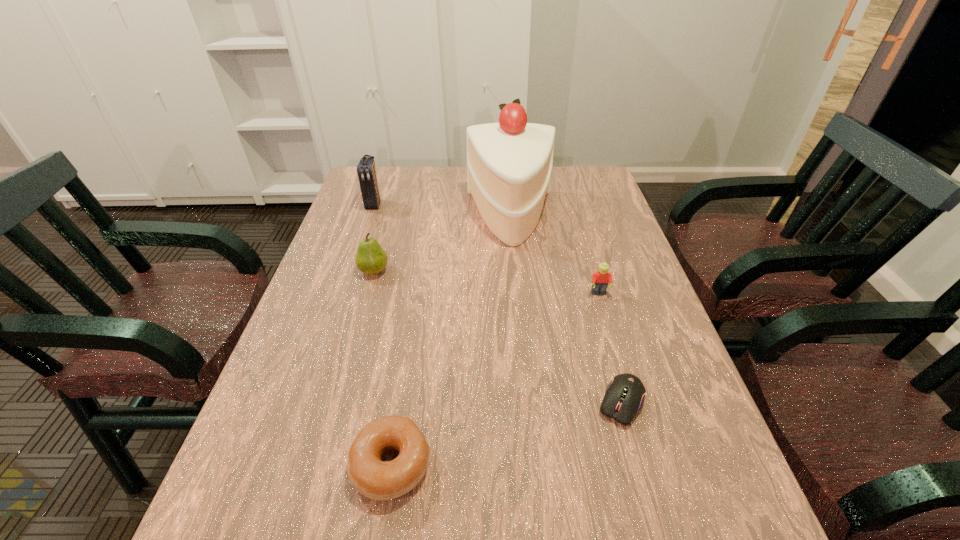
What are the coordinates of `vacant space located 0.200m on the left of the cake` in the screenshot? It's located at (402, 217).

Where is `vacant region located with the zip open on the clutch bag`? The width and height of the screenshot is (960, 540). vacant region located with the zip open on the clutch bag is located at coordinates (368, 224).

You are a GUI agent. You are given a task and a screenshot of the screen. Output one action in this format:
    pyautogui.click(x=<x>, y=<y>)
    Task: Click on the vacant space situated on the front of the pear
    The width and height of the screenshot is (960, 540).
    Given the screenshot: What is the action you would take?
    pyautogui.click(x=350, y=353)

Find the location of `free space located 0.150m on the face of the fourth farthest object`. free space located 0.150m on the face of the fourth farthest object is located at coordinates (613, 344).

You are a GUI agent. You are given a task and a screenshot of the screen. Output one action in this format:
    pyautogui.click(x=<x>, y=<y>)
    Task: Click on the free space located 0.240m on the back of the second shortest object
    The image size is (960, 540).
    Given the screenshot: What is the action you would take?
    pyautogui.click(x=412, y=333)

Identify the location of free space located on the front of the computer mouse. (640, 470).

Find the location of `cake at the far edge`. cake at the far edge is located at coordinates (509, 164).

This screenshot has height=540, width=960. I want to click on clutch bag present at the far edge, so click(x=366, y=170).

This screenshot has width=960, height=540. In order to click on clutch bag located in the left edge section of the desktop in this screenshot , I will do `click(366, 170)`.

The image size is (960, 540). Identify the location of pear located in the left edge section of the desktop. (371, 258).